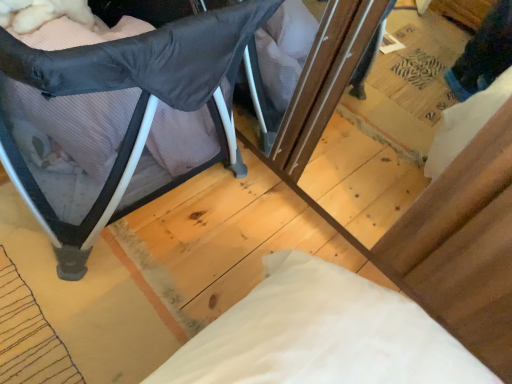
Where is `pink striped pillow at left`? pink striped pillow at left is located at coordinates (78, 121).

The image size is (512, 384). What do you see at coordinates (78, 121) in the screenshot?
I see `pink striped pillow at left` at bounding box center [78, 121].

Identify the location of matte black playpen at left. (134, 108).

This screenshot has width=512, height=384. What do you see at coordinates (134, 108) in the screenshot?
I see `matte black playpen at left` at bounding box center [134, 108].

Where is `pink striped pillow at left`? Image resolution: width=512 pixels, height=384 pixels. pink striped pillow at left is located at coordinates (78, 121).

Which is more to the right, pink striped pillow at left or matte black playpen at left?

From the viewer's perspective, pink striped pillow at left appears more on the right side.

Is the depth of pink striped pillow at left less than that of matte black playpen at left?

No, the depth of pink striped pillow at left is greater than that of matte black playpen at left.

Which is nearer, (111,106) or (142,109)?

Point (111,106).

From the image's perspective, which object appears higher, pink striped pillow at left or matte black playpen at left?

pink striped pillow at left, from the image's perspective.

From a real-world perspective, which object stands above the other?

matte black playpen at left.

Between pink striped pillow at left and matte black playpen at left, which one has larger width?

Wider between the two is matte black playpen at left.

Who is shorter, pink striped pillow at left or matte black playpen at left?

Standing shorter between the two is pink striped pillow at left.

Considering the relative sizes of pink striped pillow at left and matte black playpen at left in the image provided, is pink striped pillow at left bigger than matte black playpen at left?

Actually, pink striped pillow at left might be smaller than matte black playpen at left.

Could matte black playpen at left be considered to be inside pink striped pillow at left?

No, matte black playpen at left is located outside of pink striped pillow at left.

Is pink striped pillow at left not close to matte black playpen at left?

No, pink striped pillow at left is not far away from matte black playpen at left.

Is pink striped pillow at left oriented towards matte black playpen at left?

Yes, pink striped pillow at left is turned towards matte black playpen at left.

Image resolution: width=512 pixels, height=384 pixels. In order to click on pillow that is on the right side of matte black playpen at left in this screenshot , I will do `click(78, 121)`.

Which is more to the right, matte black playpen at left or pink striped pillow at left?

pink striped pillow at left is more to the right.

Is matte black playpen at left behind pink striped pillow at left?

No, matte black playpen at left is in front of pink striped pillow at left.

Which is behind, point (241, 18) or point (170, 155)?

Positioned behind is point (170, 155).

From the image's perspective, is matte black playpen at left on top of pink striped pillow at left?

Incorrect, from the image's perspective, matte black playpen at left is lower than pink striped pillow at left.

From a real-world perspective, who is located higher, matte black playpen at left or pink striped pillow at left?

From a 3D spatial view, matte black playpen at left is above.

Which object is wider, matte black playpen at left or pink striped pillow at left?

With larger width is matte black playpen at left.

From their relative heights in the image, would you say matte black playpen at left is taller or shorter than pink striped pillow at left?

Considering their sizes, matte black playpen at left has more height than pink striped pillow at left.

Considering the relative sizes of matte black playpen at left and pink striped pillow at left in the image provided, is matte black playpen at left smaller than pink striped pillow at left?

Incorrect, matte black playpen at left is not smaller in size than pink striped pillow at left.

Is pink striped pillow at left inside matte black playpen at left?

Yes, pink striped pillow at left is a part of matte black playpen at left.

Are matte black playpen at left and pink striped pillow at left far apart?

No, matte black playpen at left is not far away from pink striped pillow at left.

Is matte black playpen at left facing away from pink striped pillow at left?

Yes, matte black playpen at left is positioned with its back facing pink striped pillow at left.

How many degrees apart are the facing directions of matte black playpen at left and pink striped pillow at left?

The angle between the facing direction of matte black playpen at left and the facing direction of pink striped pillow at left is 0.000279 degrees.

How much distance is there between matte black playpen at left and pink striped pillow at left?

matte black playpen at left and pink striped pillow at left are 4.20 inches apart.

You are a GUI agent. You are given a task and a screenshot of the screen. Output one action in this format:
    pyautogui.click(x=<x>, y=<y>)
    Task: Click on the pillow behind the matte black playpen at left
    
    Given the screenshot: What is the action you would take?
    pyautogui.click(x=78, y=121)

The image size is (512, 384). What are the coordinates of `pillow on the right side of matte black playpen at left` in the screenshot? It's located at (78, 121).

Locate an element on the screen. This screenshot has width=512, height=384. pillow above the matte black playpen at left (from the image's perspective) is located at coordinates (78, 121).